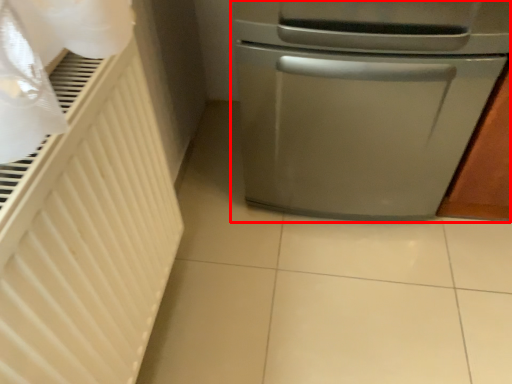
Question: From the image's perspective, considering the relative positions of home appliance (annotated by the red box) and radiator in the image provided, where is home appliance (annotated by the red box) located with respect to the staircase?

Choices:
 (A) above
 (B) below

Answer: (A)